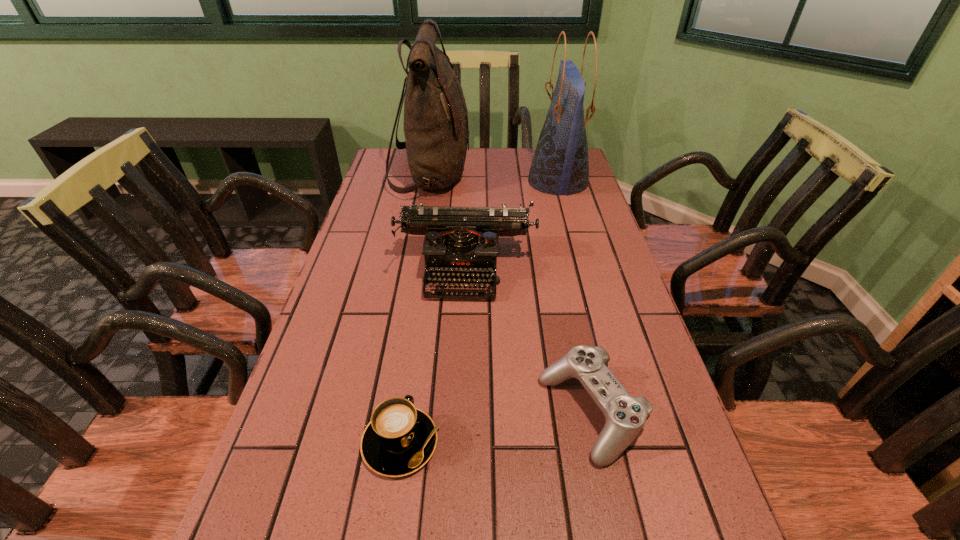
Where is `backpack`? This screenshot has height=540, width=960. backpack is located at coordinates (436, 130).

In order to click on shopping bag in this screenshot , I will do `click(560, 165)`.

Image resolution: width=960 pixels, height=540 pixels. In order to click on the third shortest object in this screenshot , I will do `click(460, 242)`.

At what (x,y) coordinates should I click in order to perform the action: click on the third farthest object. Please return your answer as a coordinate pair (x, y). Image resolution: width=960 pixels, height=540 pixels. Looking at the image, I should click on (460, 242).

The image size is (960, 540). In order to click on cappuccino in this screenshot , I will do `click(400, 439)`.

At what (x,y) coordinates should I click in order to perform the action: click on control. Please return your answer as a coordinate pair (x, y). Looking at the image, I should click on (625, 416).

Where is `vacant space situated on the open flap of the backpack`? This screenshot has height=540, width=960. vacant space situated on the open flap of the backpack is located at coordinates (528, 174).

Where is `vacant area situated on the left of the shopping bag`? This screenshot has height=540, width=960. vacant area situated on the left of the shopping bag is located at coordinates (460, 182).

You are a GUI agent. You are given a task and a screenshot of the screen. Output one action in this format:
    pyautogui.click(x=<x>, y=<y>)
    Task: Click on the free space located on the keyboard of the typewriter
    This screenshot has width=960, height=540.
    Given the screenshot: What is the action you would take?
    pyautogui.click(x=461, y=401)

Identify the location of vacant space located on the right of the cappuccino. The width and height of the screenshot is (960, 540). [x=553, y=442].